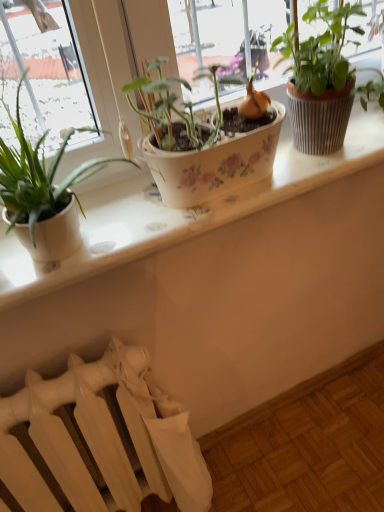
What do you see at coordinates (179, 212) in the screenshot?
I see `white ceramic window sill at center` at bounding box center [179, 212].

What is the approximate height of textured brown pot at upper right, acting as the 2th houseplant starting from the left?

It is 12.21 inches.

Where is `white ceramic window sill at center`? white ceramic window sill at center is located at coordinates (179, 212).

From a real-world perspective, which is physically above, textured brown pot at upper right, the 1th houseplant viewed from the right, or white matte radiator at lower left?

In real-world perspective, textured brown pot at upper right, the 1th houseplant viewed from the right, is above.

How many degrees apart are the facing directions of textured brown pot at upper right, acting as the 2th houseplant starting from the left, and white matte radiator at lower left?

They differ by 2.78 degrees in their facing directions.

The width and height of the screenshot is (384, 512). I want to click on radiator that is under the textured brown pot at upper right, acting as the 2th houseplant starting from the left (from a real-world perspective), so click(x=102, y=439).

Is textured brown pot at upper right, the 1th houseplant viewed from the right, directly adjacent to white matte radiator at lower left?

No, textured brown pot at upper right, the 1th houseplant viewed from the right, is not in contact with white matte radiator at lower left.

Considering the relative positions of white ceramic window sill at center and matte white pot at left, the 2th houseplant positioned from the right, in the image provided, is white ceramic window sill at center behind matte white pot at left, the 2th houseplant positioned from the right,?

Yes, it is behind matte white pot at left, the 2th houseplant positioned from the right.

Is matte white pot at left, which ranks as the 1th houseplant in left-to-right order, completely or partially inside white ceramic window sill at center?

No, matte white pot at left, which ranks as the 1th houseplant in left-to-right order, is not inside white ceramic window sill at center.

Find the location of a particular element. window sill that is behind the matte white pot at left, the 2th houseplant positioned from the right is located at coordinates (179, 212).

Is white ceramic window sill at center taller than matte white pot at left, the 2th houseplant positioned from the right?

In fact, white ceramic window sill at center may be shorter than matte white pot at left, the 2th houseplant positioned from the right.

Is textured brown pot at upper right, acting as the 2th houseplant starting from the left, placed right next to white ceramic window sill at center?

No, textured brown pot at upper right, acting as the 2th houseplant starting from the left, is not in contact with white ceramic window sill at center.

Could you tell me if textured brown pot at upper right, acting as the 2th houseplant starting from the left, is facing white ceramic window sill at center?

No, textured brown pot at upper right, acting as the 2th houseplant starting from the left, is not oriented towards white ceramic window sill at center.

Considering the relative sizes of textured brown pot at upper right, acting as the 2th houseplant starting from the left, and white ceramic window sill at center in the image provided, is textured brown pot at upper right, acting as the 2th houseplant starting from the left, taller than white ceramic window sill at center?

Yes.

From a real-world perspective, is textured brown pot at upper right, acting as the 2th houseplant starting from the left, located higher than white ceramic window sill at center?

Yes.

Is white matte radiator at lower left at the left side of white ceramic window sill at center?

Yes, white matte radiator at lower left is to the left of white ceramic window sill at center.

From a real-world perspective, who is located lower, white matte radiator at lower left or white ceramic window sill at center?

white matte radiator at lower left is physically lower.

Is white matte radiator at lower left bigger than white ceramic window sill at center?

Indeed, white matte radiator at lower left has a larger size compared to white ceramic window sill at center.

What's the angular difference between white ceramic window sill at center and textured brown pot at upper right, acting as the 2th houseplant starting from the left,'s facing directions?

→ The angular difference between white ceramic window sill at center and textured brown pot at upper right, acting as the 2th houseplant starting from the left, is 2.55 degrees.

Would you say white ceramic window sill at center is a long distance from textured brown pot at upper right, the 1th houseplant viewed from the right?

No, white ceramic window sill at center is not far from textured brown pot at upper right, the 1th houseplant viewed from the right.

From the image's perspective, is white ceramic window sill at center beneath textured brown pot at upper right, acting as the 2th houseplant starting from the left?

Indeed, from the image's perspective, white ceramic window sill at center is shown beneath textured brown pot at upper right, acting as the 2th houseplant starting from the left.

Is white ceramic window sill at center inside the boundaries of textured brown pot at upper right, acting as the 2th houseplant starting from the left, or outside?

white ceramic window sill at center is not enclosed by textured brown pot at upper right, acting as the 2th houseplant starting from the left.

Which object is further away from the camera taking this photo, matte white pot at left, which ranks as the 1th houseplant in left-to-right order, or textured brown pot at upper right, the 1th houseplant viewed from the right?

textured brown pot at upper right, the 1th houseplant viewed from the right, is behind.

Visually, is matte white pot at left, the 2th houseplant positioned from the right, positioned to the left or to the right of textured brown pot at upper right, acting as the 2th houseplant starting from the left?

Clearly, matte white pot at left, the 2th houseplant positioned from the right, is on the left of textured brown pot at upper right, acting as the 2th houseplant starting from the left, in the image.

Is matte white pot at left, which ranks as the 1th houseplant in left-to-right order, smaller than textured brown pot at upper right, acting as the 2th houseplant starting from the left?

Actually, matte white pot at left, which ranks as the 1th houseplant in left-to-right order, might be larger than textured brown pot at upper right, acting as the 2th houseplant starting from the left.

Which object is closer to the camera taking this photo, matte white pot at left, which ranks as the 1th houseplant in left-to-right order, or white matte radiator at lower left?

matte white pot at left, which ranks as the 1th houseplant in left-to-right order.

From a real-world perspective, is matte white pot at left, which ranks as the 1th houseplant in left-to-right order, beneath white matte radiator at lower left?

No, from a real-world perspective, matte white pot at left, which ranks as the 1th houseplant in left-to-right order, is not beneath white matte radiator at lower left.

Could you tell me if matte white pot at left, which ranks as the 1th houseplant in left-to-right order, is turned towards white matte radiator at lower left?

No, matte white pot at left, which ranks as the 1th houseplant in left-to-right order, is not turned towards white matte radiator at lower left.

What's the angular difference between matte white pot at left, the 2th houseplant positioned from the right, and white matte radiator at lower left's facing directions?

The angle between the facing direction of matte white pot at left, the 2th houseplant positioned from the right, and the facing direction of white matte radiator at lower left is 2.78 degrees.

Locate an element on the screen. The image size is (384, 512). radiator below the textured brown pot at upper right, the 1th houseplant viewed from the right (from a real-world perspective) is located at coordinates (102, 439).

Locate an element on the screen. This screenshot has height=512, width=384. window sill behind the matte white pot at left, the 2th houseplant positioned from the right is located at coordinates (179, 212).

Based on their spatial positions, is white matte radiator at lower left or textured brown pot at upper right, the 1th houseplant viewed from the right, closer to white ceramic window sill at center?

Among the two, textured brown pot at upper right, the 1th houseplant viewed from the right, is located nearer to white ceramic window sill at center.

Which object lies further to the anchor point white matte radiator at lower left, white ceramic window sill at center or matte white pot at left, the 2th houseplant positioned from the right?

matte white pot at left, the 2th houseplant positioned from the right, lies further to white matte radiator at lower left than the other object.

Looking at the image, which one is located further to white ceramic window sill at center, textured brown pot at upper right, the 1th houseplant viewed from the right, or matte white pot at left, the 2th houseplant positioned from the right?

textured brown pot at upper right, the 1th houseplant viewed from the right, is positioned further to the anchor white ceramic window sill at center.

Which object lies further to the anchor point matte white pot at left, which ranks as the 1th houseplant in left-to-right order, textured brown pot at upper right, acting as the 2th houseplant starting from the left, or white matte radiator at lower left?

Based on the image, white matte radiator at lower left appears to be further to matte white pot at left, which ranks as the 1th houseplant in left-to-right order.

Which object lies further to the anchor point white matte radiator at lower left, textured brown pot at upper right, acting as the 2th houseplant starting from the left, or white ceramic window sill at center?

Among the two, textured brown pot at upper right, acting as the 2th houseplant starting from the left, is located further to white matte radiator at lower left.

Considering their positions, is matte white pot at left, the 2th houseplant positioned from the right, positioned further to white ceramic window sill at center than textured brown pot at upper right, acting as the 2th houseplant starting from the left?

→ textured brown pot at upper right, acting as the 2th houseplant starting from the left, lies further to white ceramic window sill at center than the other object.

From the image, which object appears to be farther from textured brown pot at upper right, acting as the 2th houseplant starting from the left, white matte radiator at lower left or white ceramic window sill at center?

white matte radiator at lower left lies further to textured brown pot at upper right, acting as the 2th houseplant starting from the left, than the other object.

From the image, which object appears to be nearer to matte white pot at left, which ranks as the 1th houseplant in left-to-right order, white ceramic window sill at center or textured brown pot at upper right, the 1th houseplant viewed from the right?

Based on the image, white ceramic window sill at center appears to be nearer to matte white pot at left, which ranks as the 1th houseplant in left-to-right order.

The height and width of the screenshot is (512, 384). In order to click on window sill between textured brown pot at upper right, acting as the 2th houseplant starting from the left, and white matte radiator at lower left, in the vertical direction in this screenshot , I will do `click(179, 212)`.

The height and width of the screenshot is (512, 384). I want to click on houseplant between white ceramic window sill at center and white matte radiator at lower left vertically, so click(x=42, y=192).

The image size is (384, 512). Find the location of `houseplant between textured brown pot at upper right, the 1th houseplant viewed from the right, and white matte radiator at lower left in the up-down direction`. houseplant between textured brown pot at upper right, the 1th houseplant viewed from the right, and white matte radiator at lower left in the up-down direction is located at coordinates (42, 192).

Find the location of a particular element. This screenshot has height=512, width=384. window sill between matte white pot at left, which ranks as the 1th houseplant in left-to-right order, and textured brown pot at upper right, acting as the 2th houseplant starting from the left is located at coordinates (179, 212).